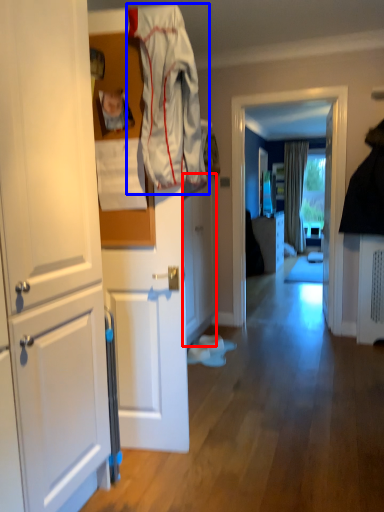
Question: Which object appears closest to the camera in this image, cabinetry (highlighted by a red box) or clothing (highlighted by a blue box)?

Choices:
 (A) cabinetry
 (B) clothing

Answer: (B)